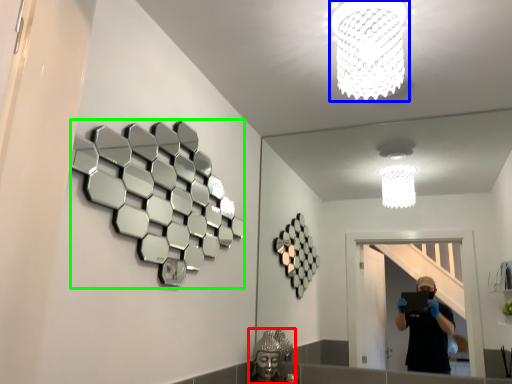
Question: Which is nearer to the reflection (highlighted by a red box)? lamp (highlighted by a blue box) or mirror (highlighted by a green box).

Choices:
 (A) lamp
 (B) mirror

Answer: (B)